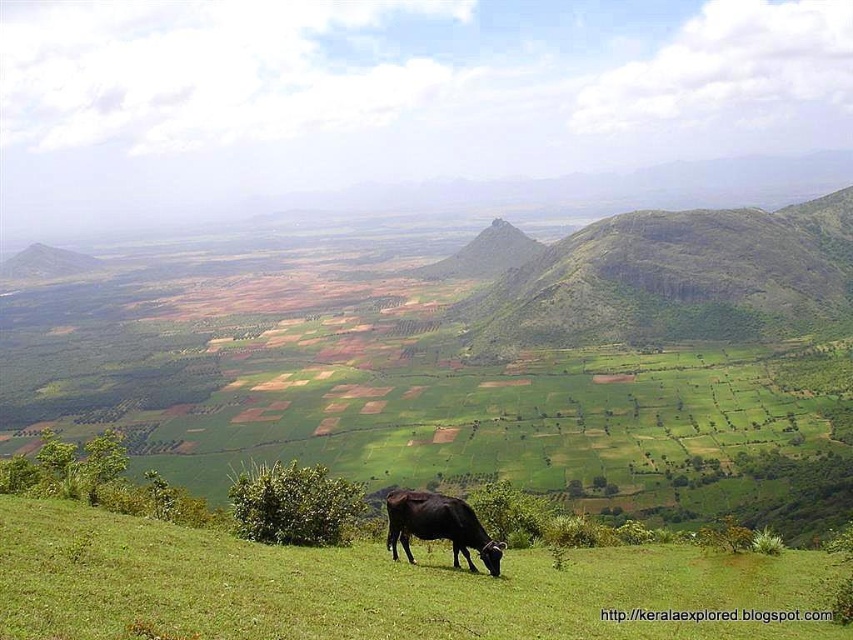
You are standing on the green grassy hill at upper center and want to walk down to the black glossy cow at lower center. Is the cow located below or above you?

The black glossy cow at lower center is located below you because the green grassy hill at upper center is positioned over it.

You are a photographer planning to capture a landscape photo that includes both the green grassy hill at upper center and the black glossy cow at lower center. Given the spatial relationship between them, which object will occupy more of the frame in your photo?

The green grassy hill at upper center will occupy more of the frame in your photo because it is larger in size than the black glossy cow at lower center.

You are a photographer trying to capture the black glossy cow at lower center in the foreground while including as much of the green grassy field at lower center as possible. Based on their sizes, which object will occupy more of the frame?

The green grassy field at lower center will occupy more of the frame since its width is larger than the black glossy cow at lower center.